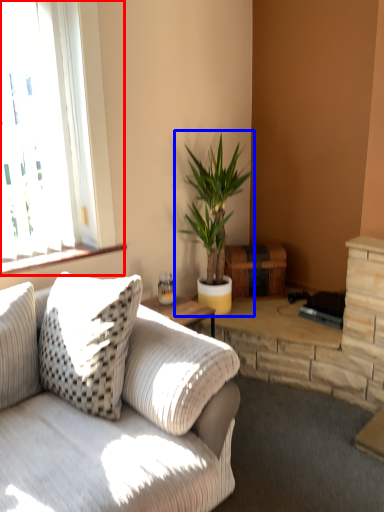
Question: Which point is closer to the camera, window (highlighted by a red box) or houseplant (highlighted by a blue box)?

Choices:
 (A) window
 (B) houseplant

Answer: (A)